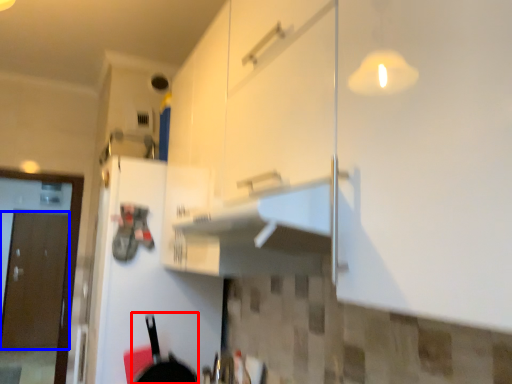
Question: Which object is closer to the camera taking this photo, frying pan (highlighted by a red box) or door (highlighted by a blue box)?

Choices:
 (A) frying pan
 (B) door

Answer: (A)